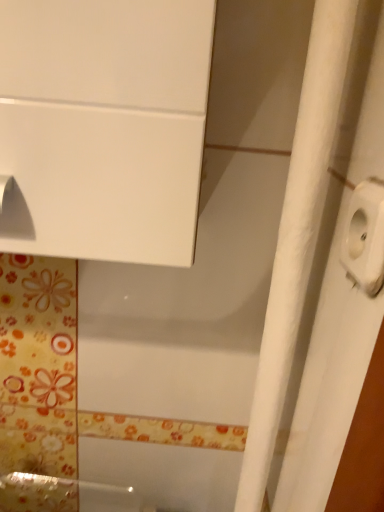
I want to click on white plastic toilet paper at right, so click(365, 237).

In order to face white plastic toilet paper at right, should I rotate leftwards or rightwards?

To align with it, rotate right about 21.442°.

Describe the element at coordinates (365, 237) in the screenshot. I see `white plastic toilet paper at right` at that location.

Where is `white plastic toilet paper at right`? white plastic toilet paper at right is located at coordinates (365, 237).